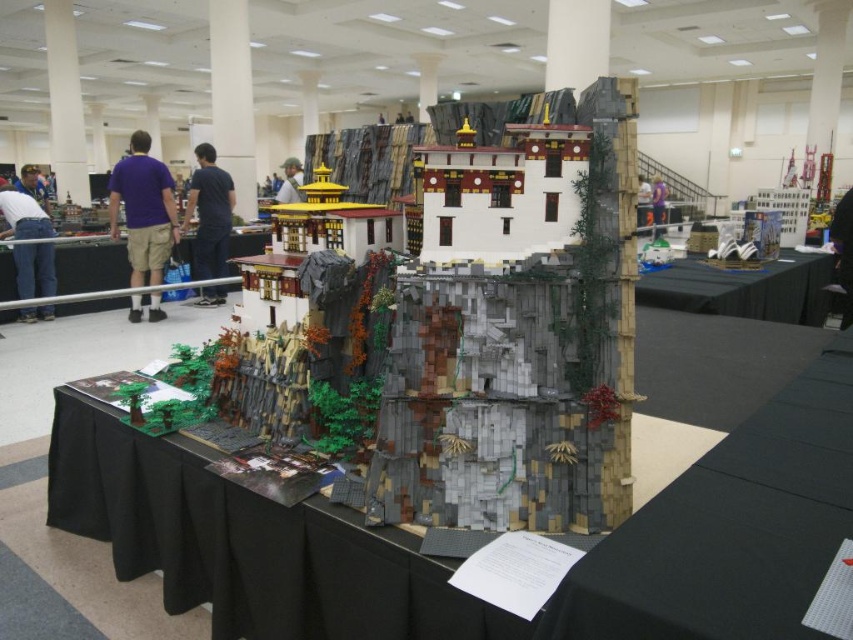
Question: Is purple cotton shirt at left in front of dark blue shirt at center?

Choices:
 (A) no
 (B) yes

Answer: (B)

Question: Can you confirm if black plastic table at center is positioned below white cotton shirt at left?

Choices:
 (A) no
 (B) yes

Answer: (B)

Question: Among these objects, which one is farthest from the camera?

Choices:
 (A) black plastic table at center
 (B) dark blue shirt at center

Answer: (B)

Question: Which point appears farthest from the camera in this image?

Choices:
 (A) (186, 198)
 (B) (302, 198)

Answer: (A)

Question: Does brick-like lego structure at center appear on the right side of dark blue shirt at center?

Choices:
 (A) no
 (B) yes

Answer: (B)

Question: Which object is closer to the camera taking this photo?

Choices:
 (A) dark blue shirt at center
 (B) black fabric table at upper right
 (C) purple fabric at center

Answer: (B)